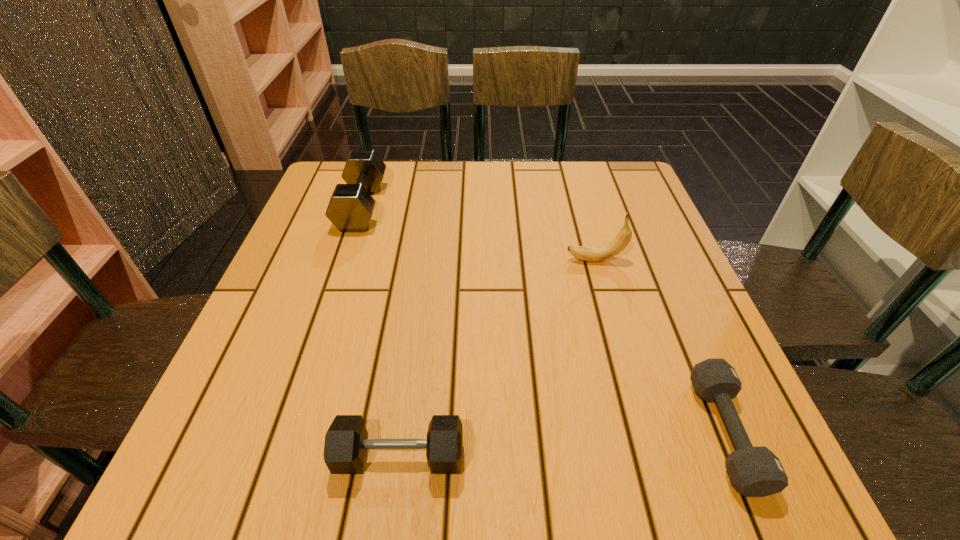
Locate an element on the screen. Image resolution: width=960 pixels, height=540 pixels. the third nearest object is located at coordinates (592, 254).

At what (x,y) coordinates should I click in order to perform the action: click on the third object from left to right. Please return your answer as a coordinate pair (x, y). Image resolution: width=960 pixels, height=540 pixels. Looking at the image, I should click on (592, 254).

Locate an element on the screen. This screenshot has height=540, width=960. the tallest dumbbell is located at coordinates (350, 208).

Locate an element on the screen. This screenshot has width=960, height=540. the farthest object is located at coordinates (350, 208).

Where is `the second shortest dumbbell`? This screenshot has width=960, height=540. the second shortest dumbbell is located at coordinates (346, 441).

Image resolution: width=960 pixels, height=540 pixels. I want to click on the second shortest object, so click(x=346, y=441).

Image resolution: width=960 pixels, height=540 pixels. What are the coordinates of `the shortest dumbbell` in the screenshot? It's located at click(756, 471).

Locate an element on the screen. This screenshot has width=960, height=540. the rightmost dumbbell is located at coordinates (756, 471).

Identify the location of free spot located 0.240m at the start of the peel on the third object from left to right. (455, 260).

At what (x,y) coordinates should I click in order to perform the action: click on vacant space located 0.060m at the start of the peel on the third object from left to right. Please return your answer as a coordinate pair (x, y). Looking at the image, I should click on (539, 260).